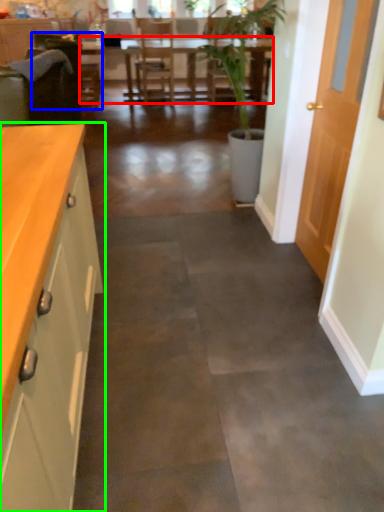
Question: Which object is positioned closest to table (highlighted by a red box)? Select from armchair (highlighted by a blue box) and cabinetry (highlighted by a green box).

Choices:
 (A) armchair
 (B) cabinetry

Answer: (A)